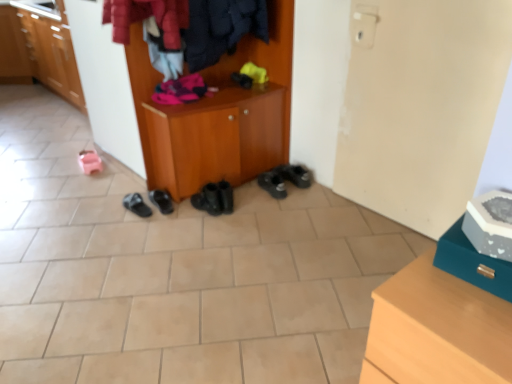
Question: Is pink rubber sandals at lower left, which is the first footwear in left-to-right order, to the left or to the right of black rubber shoes at lower right, which is the sixth footwear in left-to-right order, in the image?

Choices:
 (A) left
 (B) right

Answer: (A)

Question: From a real-world perspective, is pink rubber sandals at lower left, marked as the 6th footwear in a right-to-left arrangement, positioned above or below black rubber shoes at lower right, positioned as the 1th footwear in right-to-left order?

Choices:
 (A) above
 (B) below

Answer: (B)

Question: Which object is positioned closest to the teal leather shoe at lower right, the 1th shoe ordered from the bottom?

Choices:
 (A) black rubber sandals at center, placed as the 5th footwear when sorted from right to left
 (B) black rubber boots at center, the 4th footwear viewed from the left
 (C) velvet-like red coat at upper center
 (D) teak wood chest of drawers at lower right
 (E) wooden cabinet at center, which is counted as the second cabinetry, starting from the top

Answer: (D)

Question: Estimate the real-world distances between objects in this image. Which object is farther from the teal leather shoe at lower right, the 1th shoe ordered from the bottom?

Choices:
 (A) black rubber shoes at center, the second footwear in the right-to-left sequence
 (B) matte wood cabinet at left, the first cabinetry viewed from the back
 (C) white matte shoe at upper right, marked as the first shoe in a top-to-bottom arrangement
 (D) velvet-like red coat at upper center
 (E) black rubber shoes at lower right, positioned as the 1th footwear in right-to-left order

Answer: (B)